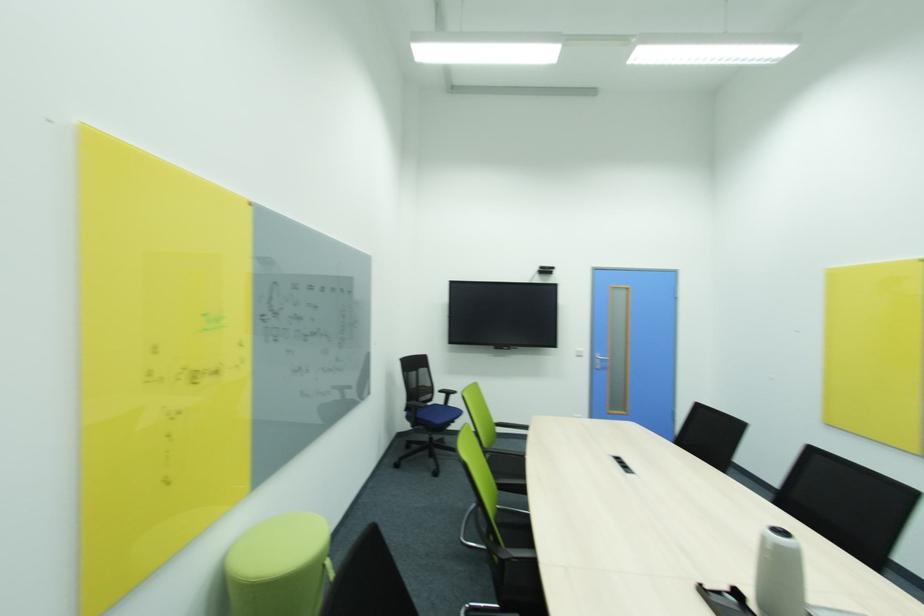
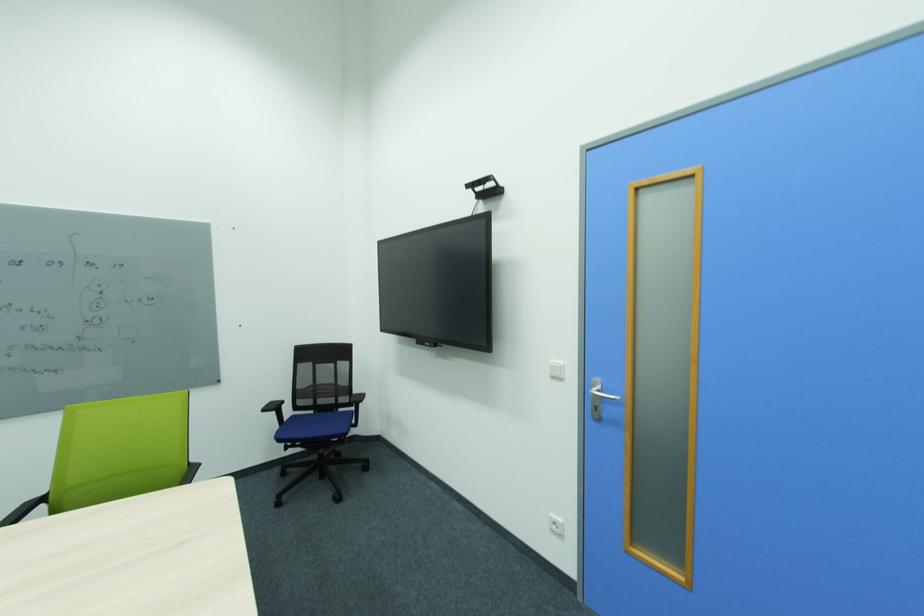
Where in the second image is the point corresponding to [582,353] from the first image?

(557, 368)